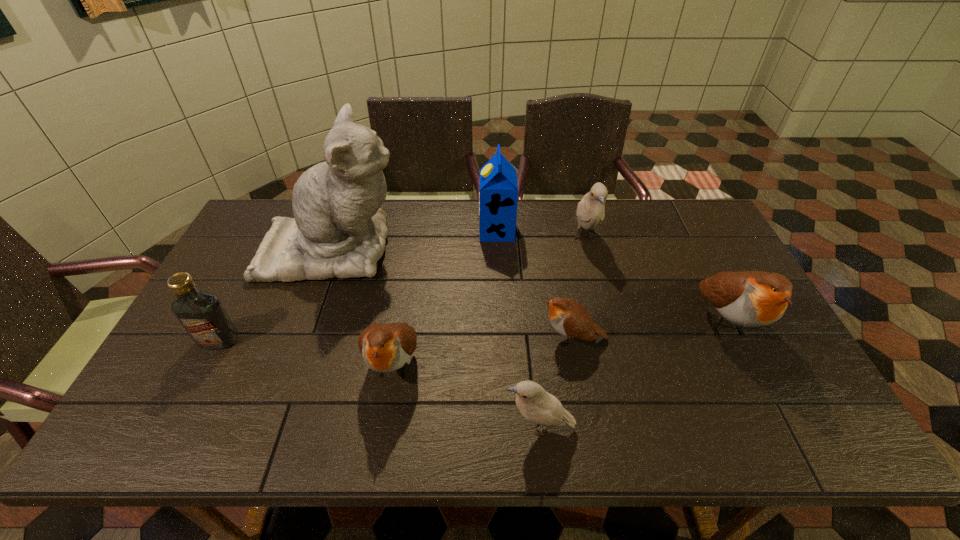
Locate an element on the screen. This screenshot has height=540, width=960. the nearest bird is located at coordinates (535, 404).

Identify the location of the smallest brown bird. (569, 318).

Identify the location of the shortest bird. The height and width of the screenshot is (540, 960). (569, 318).

I want to click on vacant space located 0.250m on the front-facing side of the tallest object, so click(x=481, y=249).

Locate an element on the screen. free region located with the cap open on the carton is located at coordinates (411, 231).

Locate an element on the screen. free point located 0.240m with the cap open on the carton is located at coordinates (408, 231).

The height and width of the screenshot is (540, 960). I want to click on vacant space located 0.170m with the cap open on the carton, so pos(429,231).

Locate an element on the screen. This screenshot has height=540, width=960. vacant position located 0.110m at the face of the rightmost object is located at coordinates (767, 408).

Identify the location of free space located at the beak of the farther white bird. The width and height of the screenshot is (960, 540). (595, 280).

Where is `blank area located 0.250m on the front-facing side of the vodka`? blank area located 0.250m on the front-facing side of the vodka is located at coordinates (165, 444).